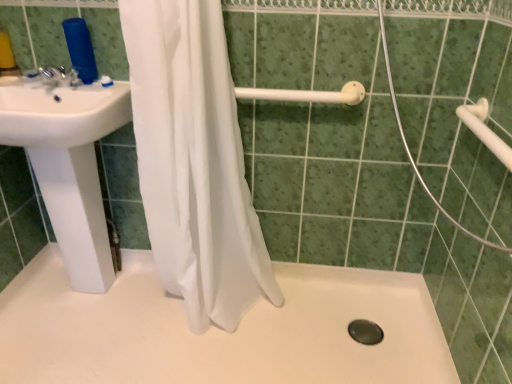
Locate an element on the screen. free area below white glossy sink at left (from a real-world perspective) is located at coordinates (82, 305).